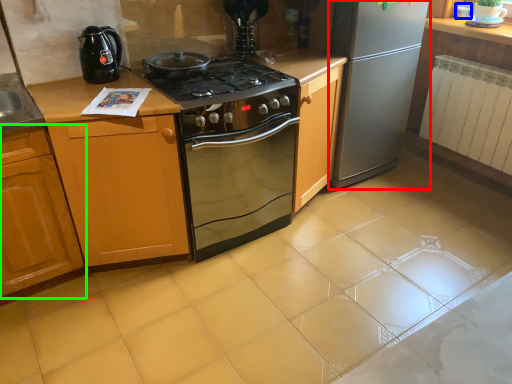
Question: Which is nearer to the refrigerator (highlighted by a red box)? appliance (highlighted by a blue box) or cabinetry (highlighted by a green box).

Choices:
 (A) appliance
 (B) cabinetry

Answer: (A)